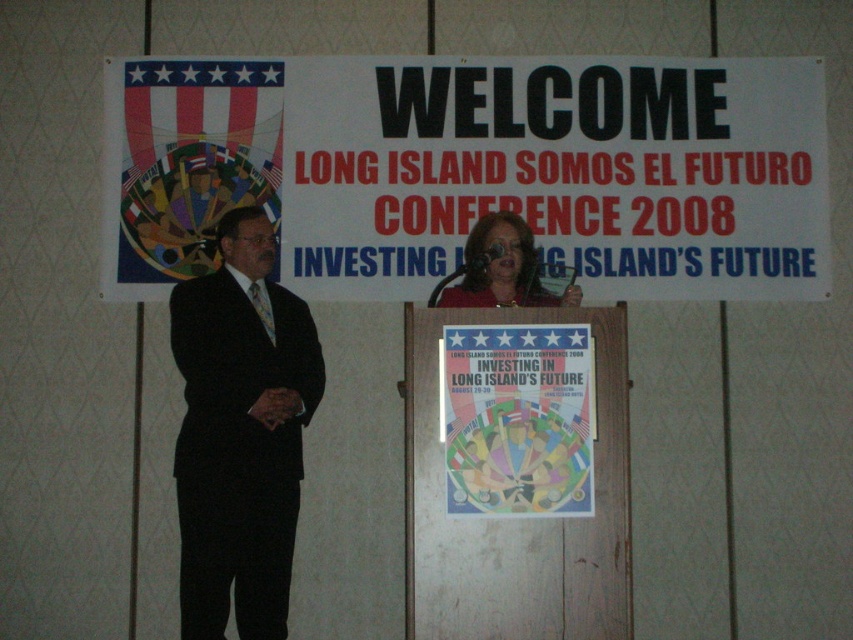
Question: In this image, where is black suit at left located relative to wooden poster at center?

Choices:
 (A) above
 (B) below

Answer: (A)

Question: Can you confirm if metallic poster at center is positioned above matte red blouse at center?

Choices:
 (A) no
 (B) yes

Answer: (A)

Question: Which is farther from the white paper sign at upper center?

Choices:
 (A) matte red blouse at center
 (B) metallic poster at center
 (C) wooden poster at center
 (D) black suit at left

Answer: (C)

Question: Among these objects, which one is farthest from the camera?

Choices:
 (A) wooden poster at center
 (B) matte red blouse at center
 (C) white paper sign at upper center
 (D) black suit at left

Answer: (C)

Question: Which is farther from the white paper sign at upper center?

Choices:
 (A) black suit at left
 (B) metallic poster at center

Answer: (B)

Question: Is white paper sign at upper center below wooden poster at center?

Choices:
 (A) no
 (B) yes

Answer: (A)